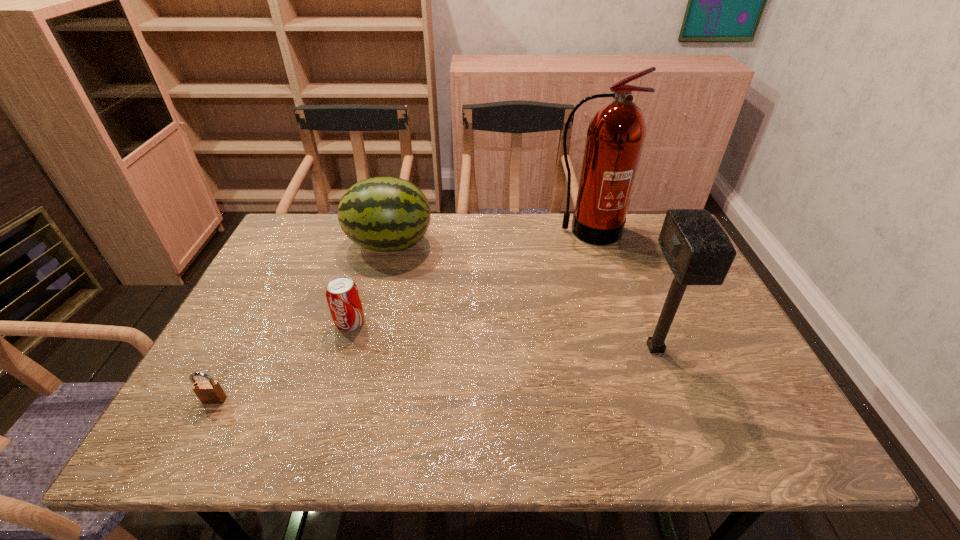
Where is `free point located on the front-facing side of the padlock`? free point located on the front-facing side of the padlock is located at coordinates (197, 434).

Find the location of `fire extinguisher present at the far edge`. fire extinguisher present at the far edge is located at coordinates point(616,134).

The height and width of the screenshot is (540, 960). Identify the location of watermelon that is at the far edge. (385, 213).

Where is `object that is at the left edge`? The image size is (960, 540). object that is at the left edge is located at coordinates (209, 392).

Image resolution: width=960 pixels, height=540 pixels. What are the coordinates of `vacant region at the far edge of the desktop` in the screenshot? It's located at (447, 221).

You are a GUI agent. You are given a task and a screenshot of the screen. Output one action in this format:
    pyautogui.click(x=<x>, y=<y>)
    Task: Click on the free region at the near edge
    Image resolution: width=960 pixels, height=540 pixels.
    Given the screenshot: What is the action you would take?
    pyautogui.click(x=300, y=448)

Identify the location of vacant area at the left edge of the desktop. The image size is (960, 540). (277, 338).

Find the location of a particular element. The image size is (960, 540). free space at the right edge of the desktop is located at coordinates (684, 335).

In the image, there is a desktop. Where is `vacant space at the far left corner`? This screenshot has width=960, height=540. vacant space at the far left corner is located at coordinates (316, 238).

This screenshot has height=540, width=960. I want to click on vacant area that lies between the third shortest object and the leftmost object, so click(302, 322).